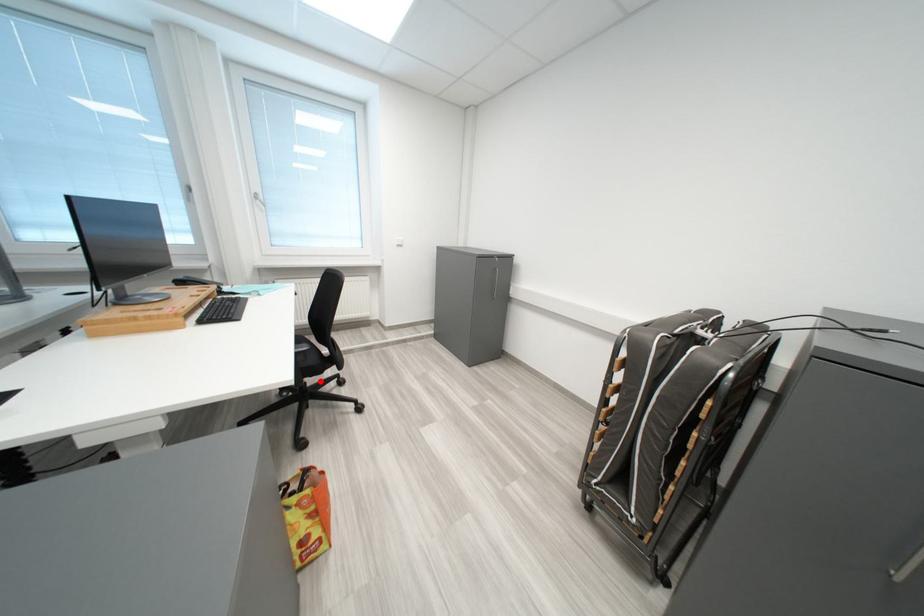
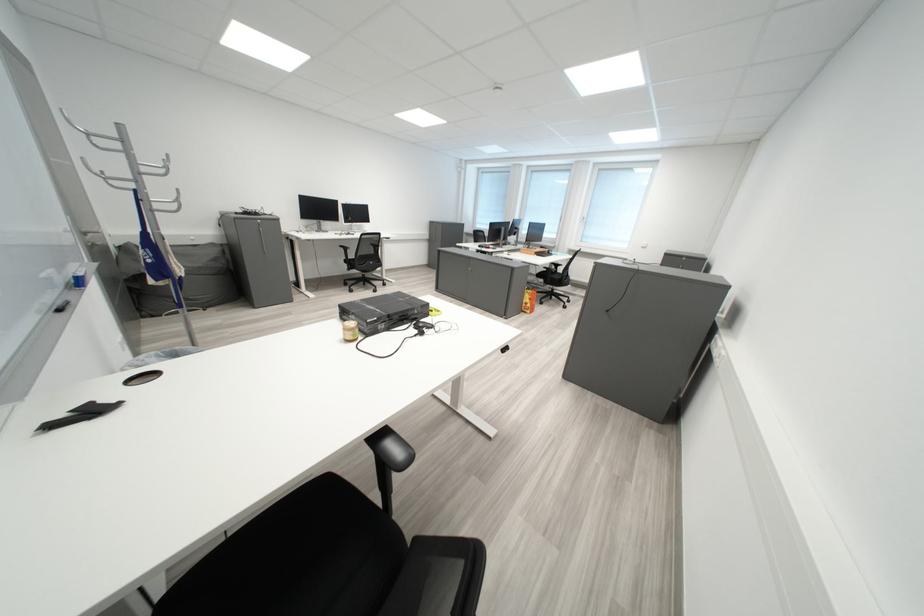
Question: I am providing you with two images of the same scene from different viewpoints. Given a red point in image1, look at the same physical point in image2. Is it:

Choices:
 (A) Closer to the viewpoint
 (B) Farther from the viewpoint

Answer: (A)